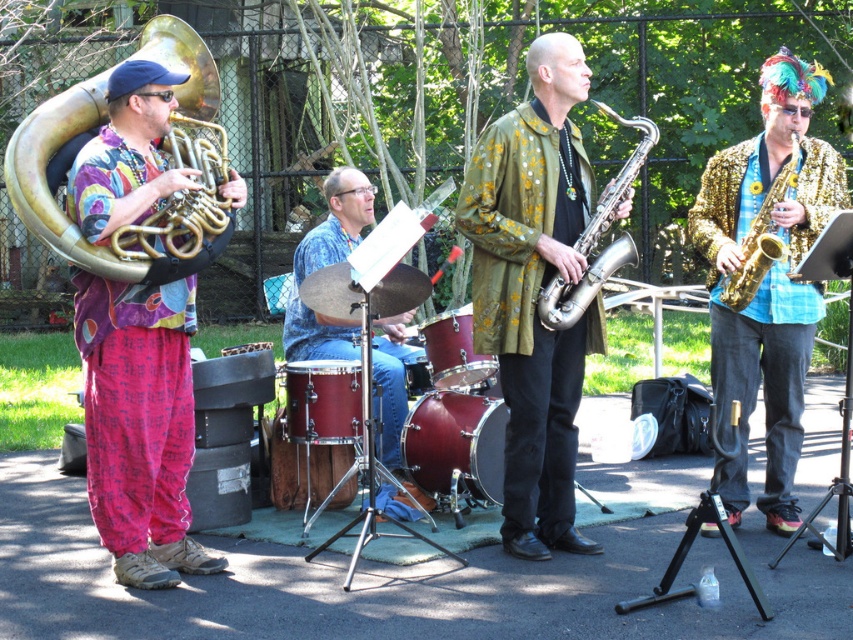
Question: Is shiny gold saxophone at center above silver metallic saxophone at center?

Choices:
 (A) yes
 (B) no

Answer: (B)

Question: Among these objects, which one is farthest from the camera?

Choices:
 (A) shiny red drum at center
 (B) shiny maroon drum at center

Answer: (B)

Question: Is shiny gold saxophone at center thinner than maroon drum at center?

Choices:
 (A) no
 (B) yes

Answer: (A)

Question: Which of the following is the closest to the observer?

Choices:
 (A) (433, 349)
 (B) (323, 397)
 (C) (524, 312)

Answer: (C)

Question: Is gold sequined jacket at right thinner than shiny maroon drum at center?

Choices:
 (A) yes
 (B) no

Answer: (B)

Question: Which object is farther from the camera taking this photo?

Choices:
 (A) gold shiny saxophone at right
 (B) gold sequined jacket at right

Answer: (B)